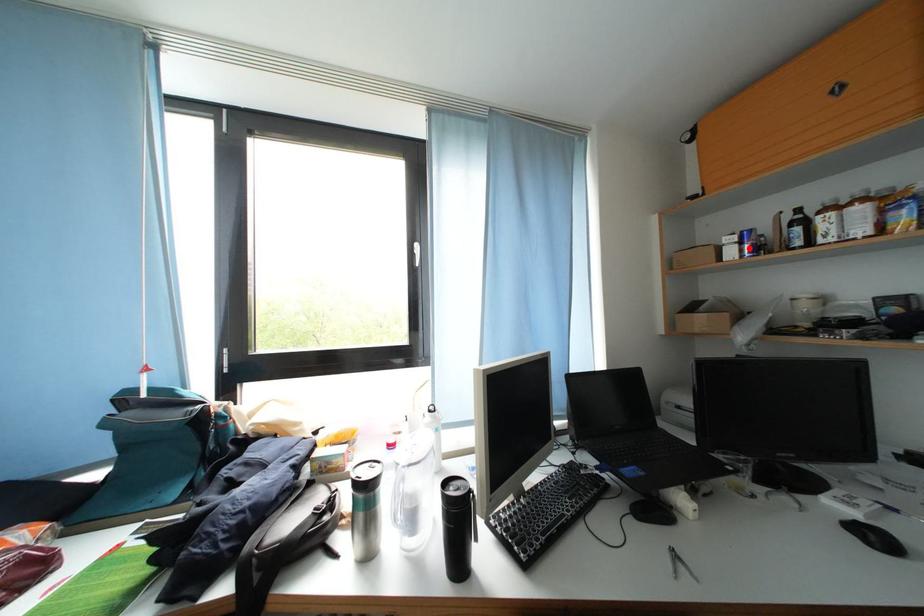
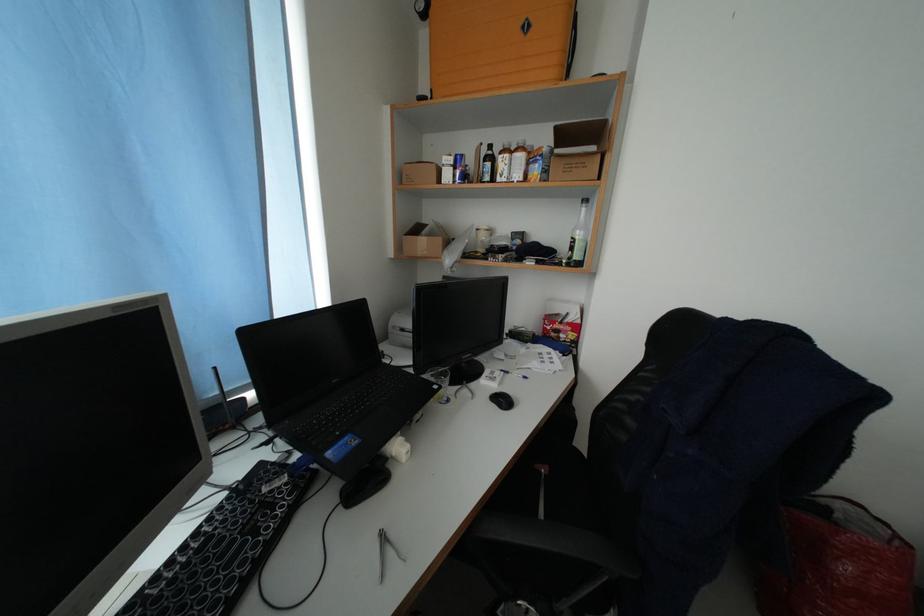
Find the pixel in the second image that matches the highlighted location in the first image.

(464, 172)